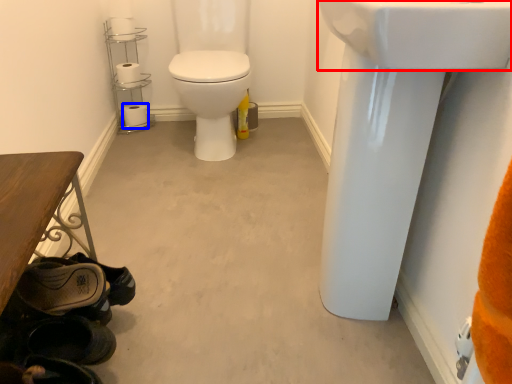
Question: Which point is further to the camera, sink (highlighted by a red box) or toilet paper (highlighted by a blue box)?

Choices:
 (A) sink
 (B) toilet paper

Answer: (B)